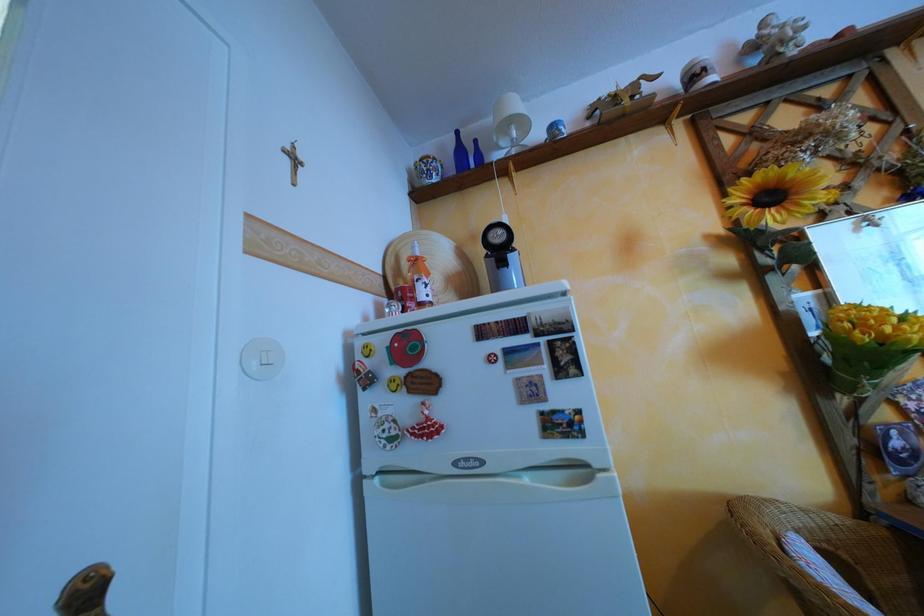
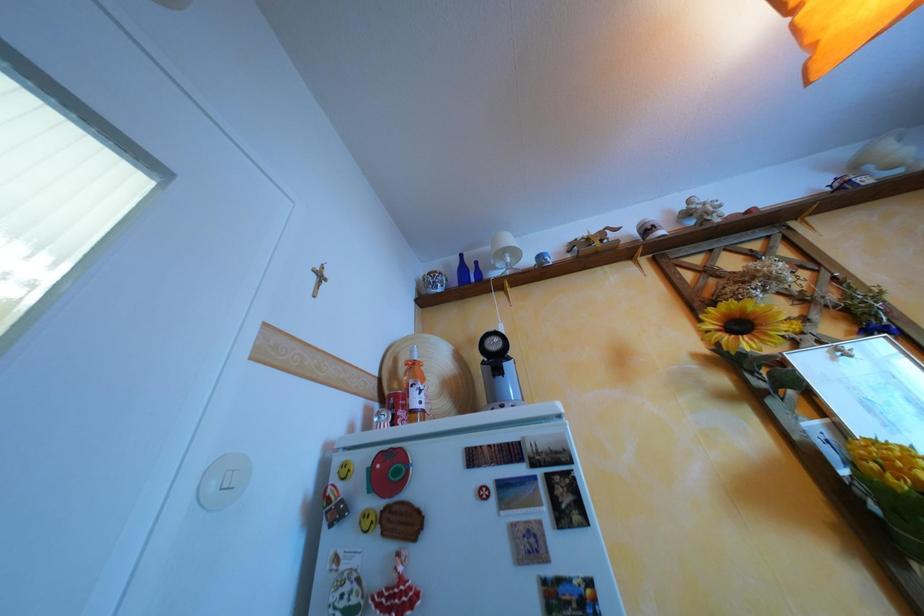
Question: In a continuous first-person perspective shot, in which direction is the camera moving?

Choices:
 (A) Left
 (B) Right
 (C) Forward
 (D) Backward

Answer: (D)